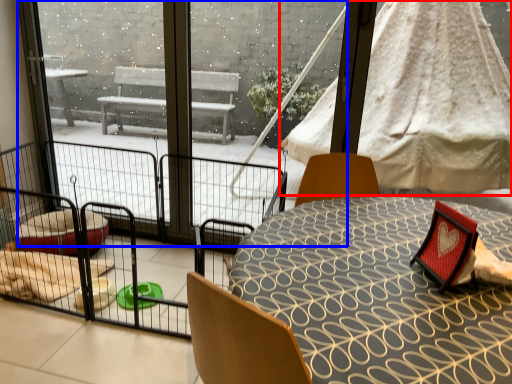
Question: Which point is further to the camera, canopy bed (highlighted by a red box) or glass door (highlighted by a blue box)?

Choices:
 (A) canopy bed
 (B) glass door

Answer: (A)